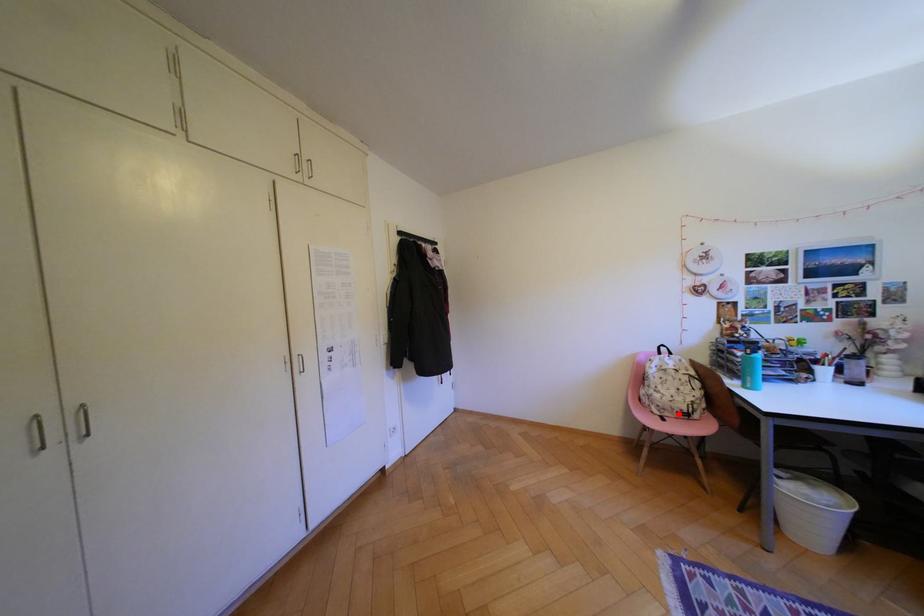
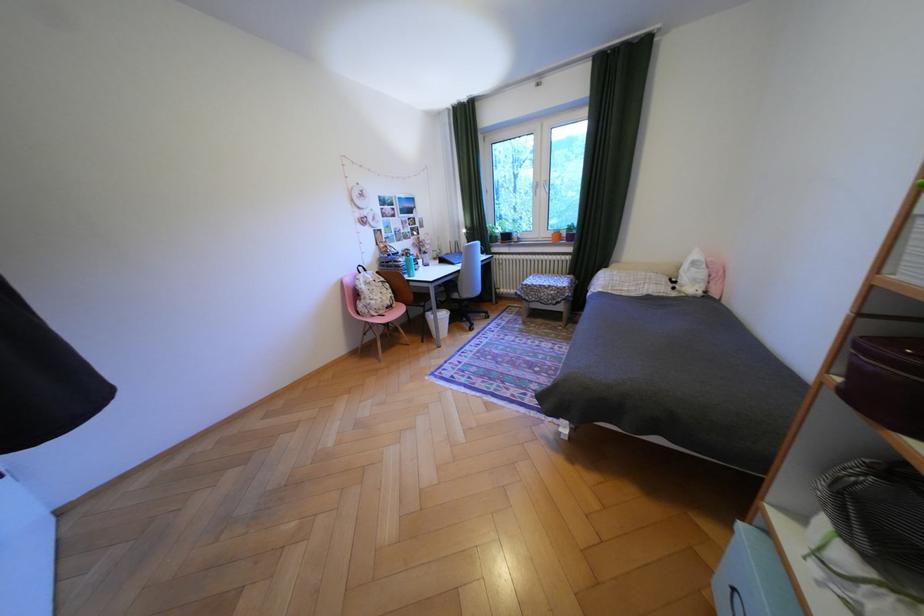
Question: A red point is marked in image1. In image2, is the corresponding 3D point closer to the camera or farther? Reply with the corresponding letter.

Choices:
 (A) The corresponding 3D point is closer.
 (B) The corresponding 3D point is farther.

Answer: (A)